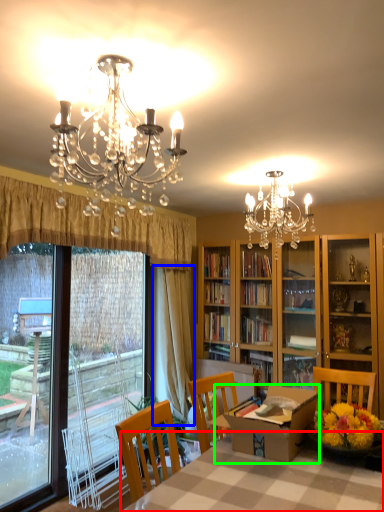
Question: Based on their relative distances, which object is farther from table (highlighted by a red box)? Choose from curtain (highlighted by a blue box) and round table (highlighted by a green box).

Choices:
 (A) curtain
 (B) round table

Answer: (A)